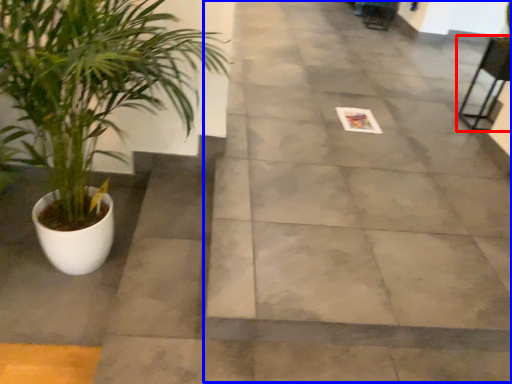
Question: Which of the following is the farthest to the observer, chair (highlighted by a red box) or pavement (highlighted by a blue box)?

Choices:
 (A) chair
 (B) pavement

Answer: (A)